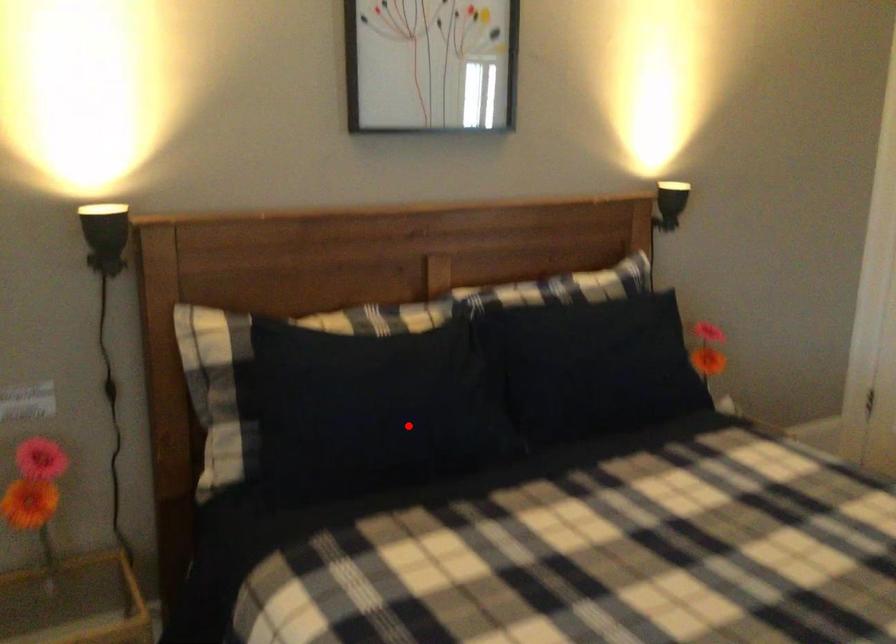
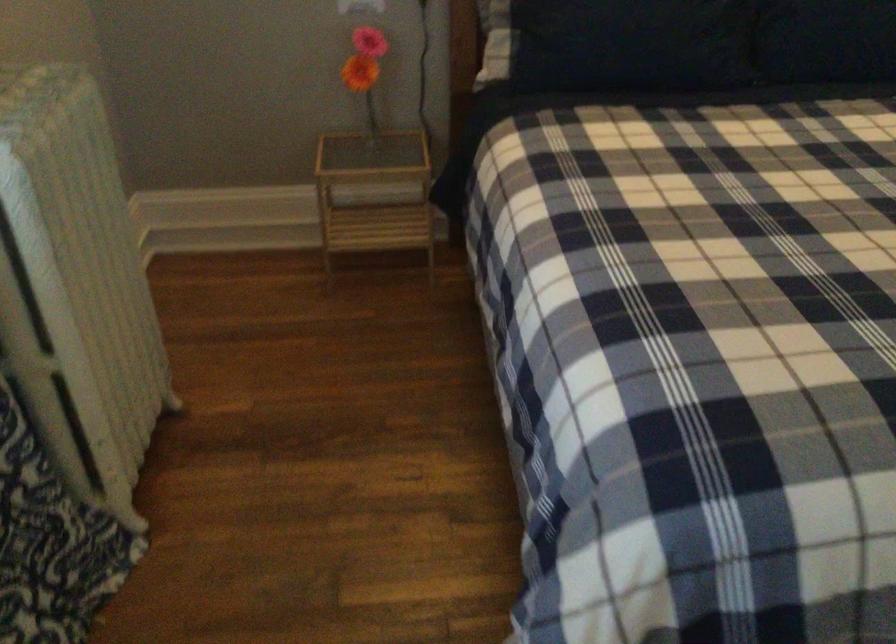
In the second image, find the point that corresponds to the highlighted location in the first image.

(631, 44)